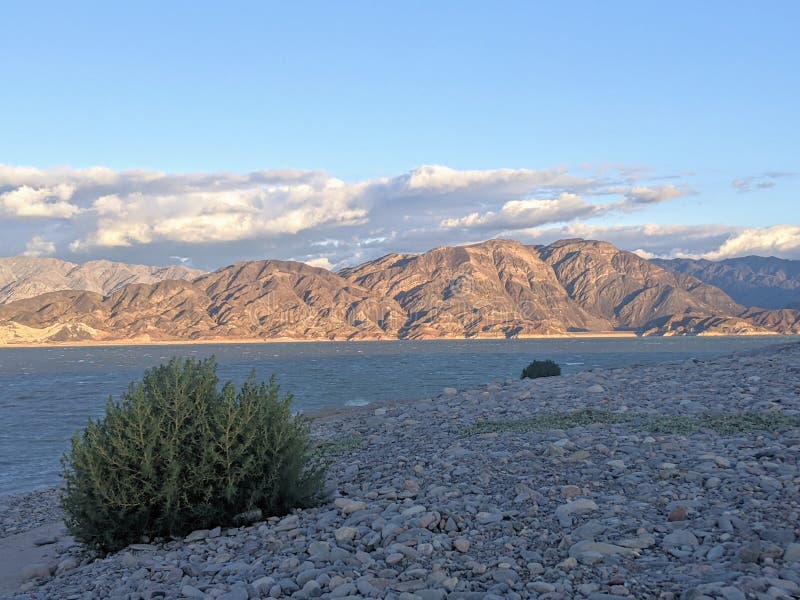
Identify the location of light. (300, 74).